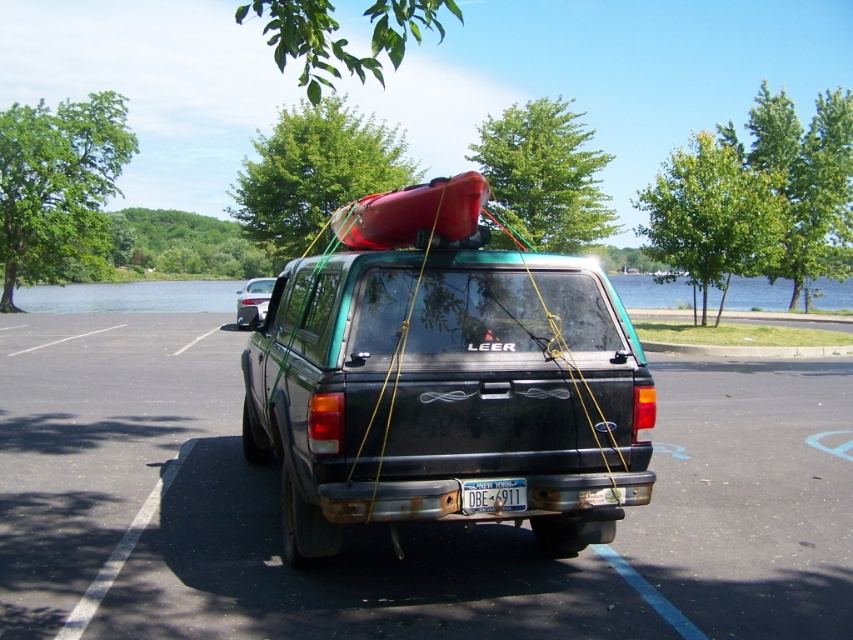
Consider the image. You are a parking attendant checking the parking lot layout. You notice two vehicles labeled as black matte truck at center and matte black truck at center. Which one is positioned lower in the image?

The black matte truck at center is located below the matte black truck at center, so it is positioned lower in the image.

You are a photographer trying to capture a clear shot of the white plastic license plate at center and the satin silver sedan at rear. Since the camera can only focus on one object at a time, which object should you focus on first to ensure it appears sharp in the photo?

The white plastic license plate at center is closer to the viewer than the satin silver sedan at rear, so you should focus on the white plastic license plate at center first to ensure it appears sharp.